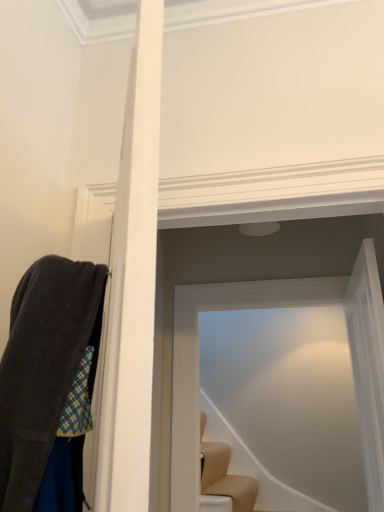
Question: From a real-world perspective, is transparent glass door at upper center, the first glass door positioned from the front, physically located above or below transparent glass door at center, the 1th glass door viewed from the back?

Choices:
 (A) below
 (B) above

Answer: (A)

Question: Based on their sizes in the image, would you say transparent glass door at upper center, the first glass door positioned from the front, is bigger or smaller than transparent glass door at center, acting as the second glass door starting from the front?

Choices:
 (A) small
 (B) big

Answer: (B)

Question: From the image's perspective, is transparent glass door at upper center, the first glass door positioned from the front, above or below transparent glass door at center, the 1th glass door viewed from the back?

Choices:
 (A) below
 (B) above

Answer: (B)

Question: Is transparent glass door at center, acting as the second glass door starting from the front, in front of or behind transparent glass door at upper center, the first glass door positioned from the front, in the image?

Choices:
 (A) front
 (B) behind

Answer: (B)

Question: Is transparent glass door at center, acting as the second glass door starting from the front, wider or thinner than transparent glass door at upper center, the first glass door positioned from the front?

Choices:
 (A) wide
 (B) thin

Answer: (B)

Question: Is transparent glass door at center, acting as the second glass door starting from the front, to the left or to the right of transparent glass door at upper center, which is counted as the 2th glass door, starting from the back, in the image?

Choices:
 (A) right
 (B) left

Answer: (B)

Question: Is transparent glass door at center, the 1th glass door viewed from the back, spatially inside transparent glass door at upper center, the first glass door positioned from the front, or outside of it?

Choices:
 (A) outside
 (B) inside

Answer: (A)